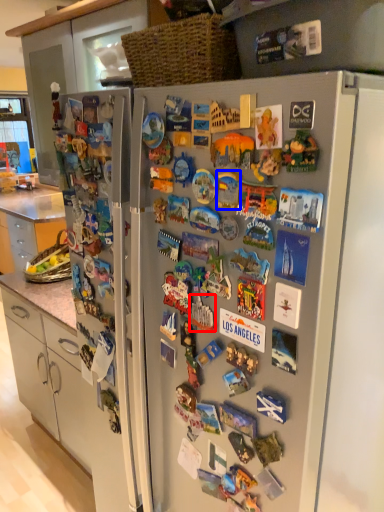
Question: Which object is further to the camera taking this photo, toy (highlighted by a red box) or toy (highlighted by a blue box)?

Choices:
 (A) toy
 (B) toy

Answer: (A)